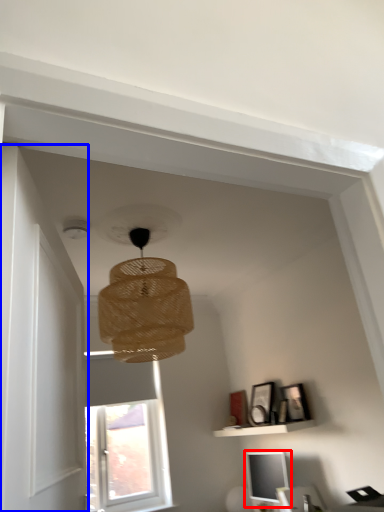
Question: Which object is closer to the camera taking this photo, computer monitor (highlighted by a red box) or door (highlighted by a blue box)?

Choices:
 (A) computer monitor
 (B) door

Answer: (B)